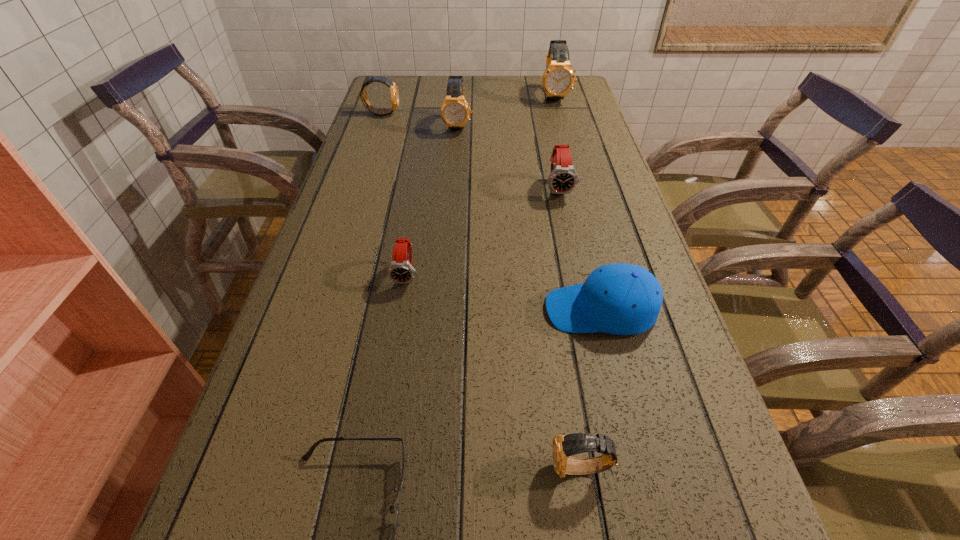
Image resolution: width=960 pixels, height=540 pixels. What are the coordinates of `the closest object relative to the tallest watch` in the screenshot? It's located at 455,112.

Point out which object is positioned as the third nearest to the nearer red watch. Please provide its 2D coordinates. Your answer should be formatted as a tuple, i.e. [(x, y)], where the tuple contains the x and y coordinates of a point satisfying the conditions above.

[(563, 178)]

Identify which watch is the nearest to the third gold watch from left to right. Please provide its 2D coordinates. Your answer should be formatted as a tuple, i.e. [(x, y)], where the tuple contains the x and y coordinates of a point satisfying the conditions above.

[(400, 270)]

You are a GUI agent. You are given a task and a screenshot of the screen. Output one action in this format:
    pyautogui.click(x=<x>, y=<y>)
    Task: Click on the watch that stands as the third closest to the leftmost gold watch
    
    Given the screenshot: What is the action you would take?
    pyautogui.click(x=563, y=178)

Choose which gold watch is the third nearest neighbor to the fourth farthest watch. Please provide its 2D coordinates. Your answer should be formatted as a tuple, i.e. [(x, y)], where the tuple contains the x and y coordinates of a point satisfying the conditions above.

[(394, 92)]

Point out which gold watch is positioned as the third nearest to the cap. Please provide its 2D coordinates. Your answer should be formatted as a tuple, i.e. [(x, y)], where the tuple contains the x and y coordinates of a point satisfying the conditions above.

[(558, 79)]

Identify the location of vacant region that satisfies the following two spatial constraints: 1. on the face of the tallest object; 2. on the face of the nearest gold watch. (654, 468).